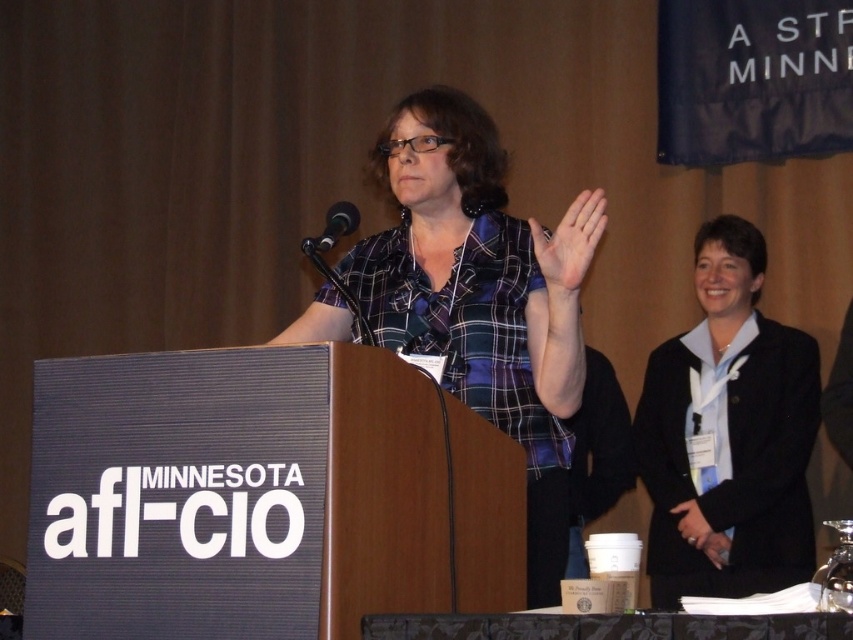
You are attending a formal event and need to place a name tag on the black fabric table at lower center. However, there is a black matte blazer at right nearby. Which object is positioned higher, requiring you to adjust your placement accordingly?

The black matte blazer at right is above the black fabric table at lower center, so you should place the name tag on the table below the blazer.

You are an event organizer at the Minnesota afl cio conference. You need to place a name tag on the black fabric table at lower center. However, there is a black matte blazer at right nearby. Which object is closer to the right edge of the table?

The black matte blazer at right is positioned on the right side of the black fabric table at lower center, so it is closer to the right edge of the table.